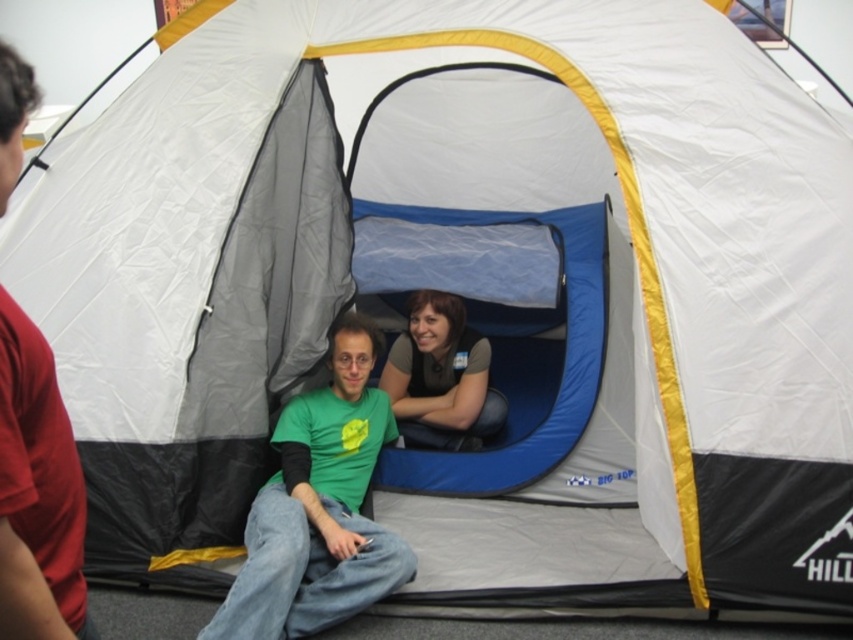
Question: Can you confirm if green matte t-shirt at center is positioned above red cotton t-shirt at left?

Choices:
 (A) no
 (B) yes

Answer: (A)

Question: Observing the image, what is the correct spatial positioning of green matte t-shirt at center in reference to matte blue shirt at center?

Choices:
 (A) below
 (B) above

Answer: (A)

Question: Which of the following is the closest to the observer?

Choices:
 (A) (70, 513)
 (B) (381, 380)

Answer: (A)

Question: Which point is farther to the camera?

Choices:
 (A) green matte t-shirt at center
 (B) red cotton t-shirt at left
 (C) matte blue shirt at center

Answer: (C)

Question: Is red cotton t-shirt at left thinner than matte blue shirt at center?

Choices:
 (A) no
 (B) yes

Answer: (B)

Question: Which point is farther to the camera?

Choices:
 (A) (20, 84)
 (B) (374, 561)
 (C) (432, 433)

Answer: (C)